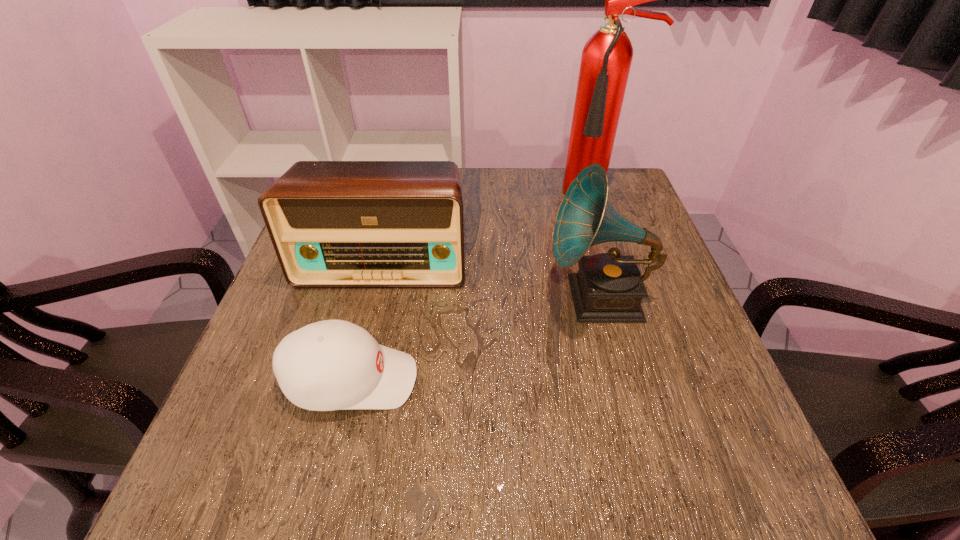
Image resolution: width=960 pixels, height=540 pixels. What are the coordinates of `the tallest object` in the screenshot? It's located at (606, 59).

This screenshot has width=960, height=540. I want to click on the farthest object, so click(606, 59).

Where is `the third shortest object`? Image resolution: width=960 pixels, height=540 pixels. the third shortest object is located at coordinates (608, 287).

This screenshot has height=540, width=960. I want to click on radio receiver, so click(x=332, y=223).

Find the location of a particular element. This screenshot has width=960, height=540. the shortest object is located at coordinates (329, 365).

The width and height of the screenshot is (960, 540). Find the location of `the nearest object`. the nearest object is located at coordinates (329, 365).

Image resolution: width=960 pixels, height=540 pixels. I want to click on free space located at the nozzle of the fire extinguisher, so click(x=635, y=307).

Find the location of a particular element. The image size is (960, 540). blank space located from the horn of the phonograph_record is located at coordinates (518, 298).

You are a GUI agent. You are given a task and a screenshot of the screen. Output one action in this format:
    pyautogui.click(x=<x>, y=<y>)
    Task: Click on the vacant space situated 0.290m from the horn of the phonograph_record
    
    Given the screenshot: What is the action you would take?
    pyautogui.click(x=410, y=298)

The image size is (960, 540). Find the location of `free location located 0.380m from the horn of the phonograph_record`. free location located 0.380m from the horn of the phonograph_record is located at coordinates (369, 298).